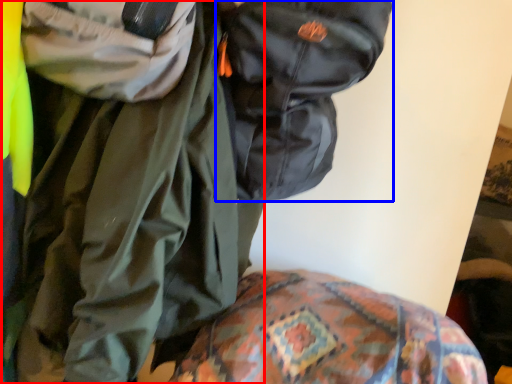
Question: Among these objects, which one is nearest to the camera, jacket (highlighted by a red box) or backpack (highlighted by a blue box)?

Choices:
 (A) jacket
 (B) backpack

Answer: (A)